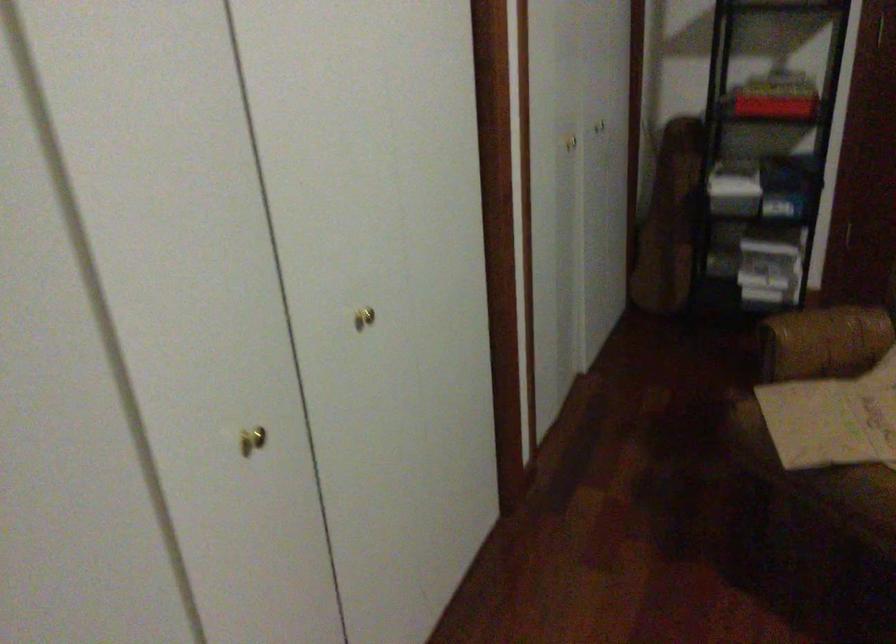
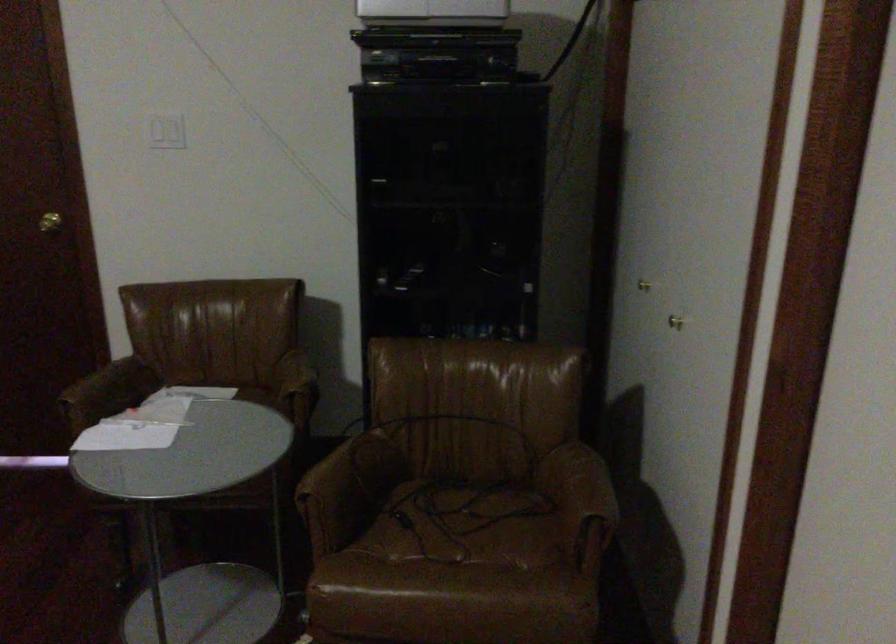
Question: Which direction would the cameraman need to move to produce the second image? Reply with the corresponding letter.

Choices:
 (A) Left
 (B) Right
 (C) Forward
 (D) Backward

Answer: (B)